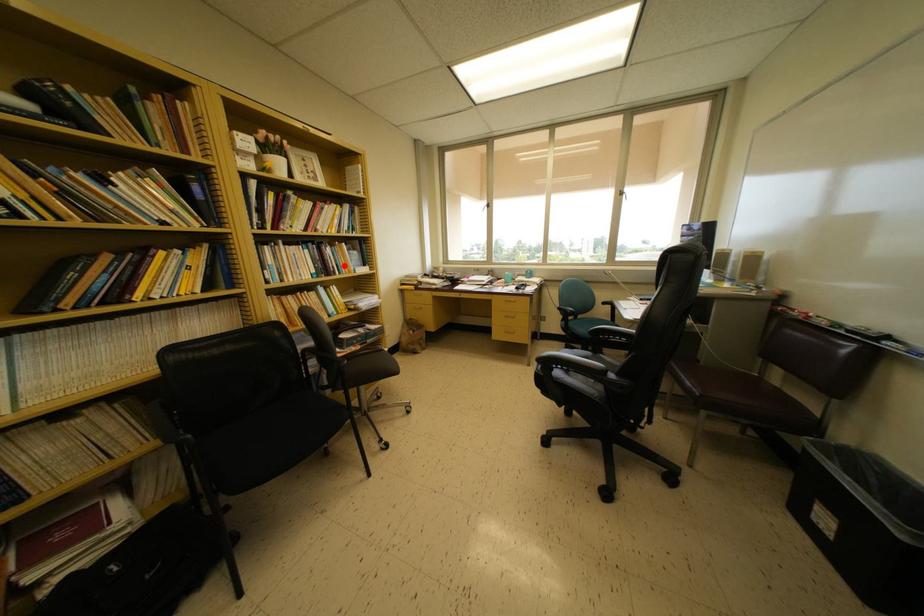
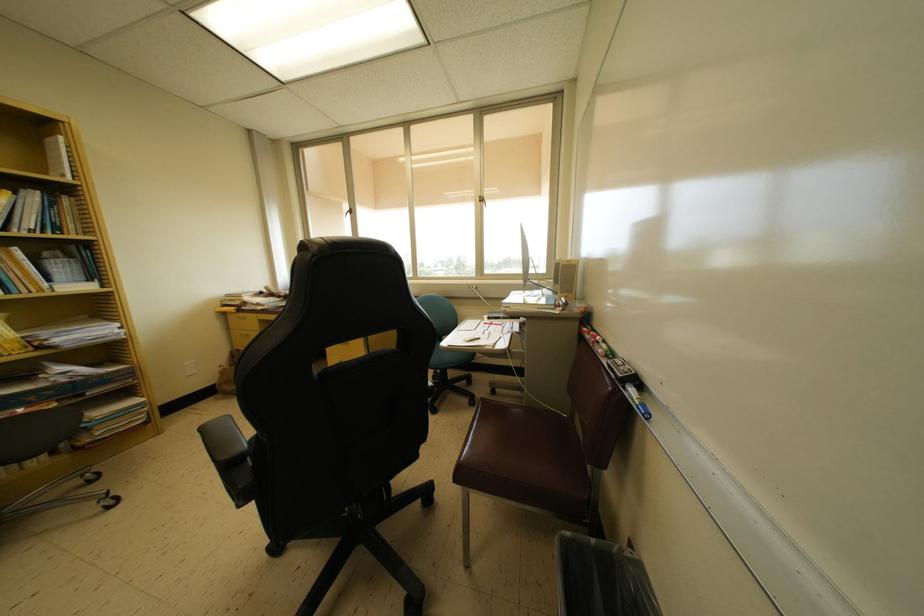
The point at the highlighted location is marked in the first image. Where is the corresponding point in the second image?

(15, 278)